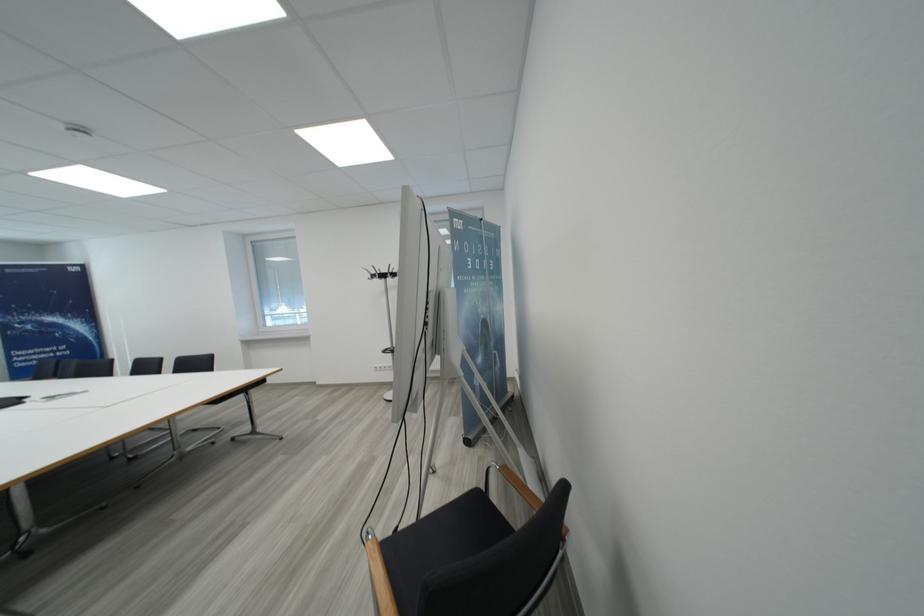
Identify the location of coat rack hook. (381, 273).